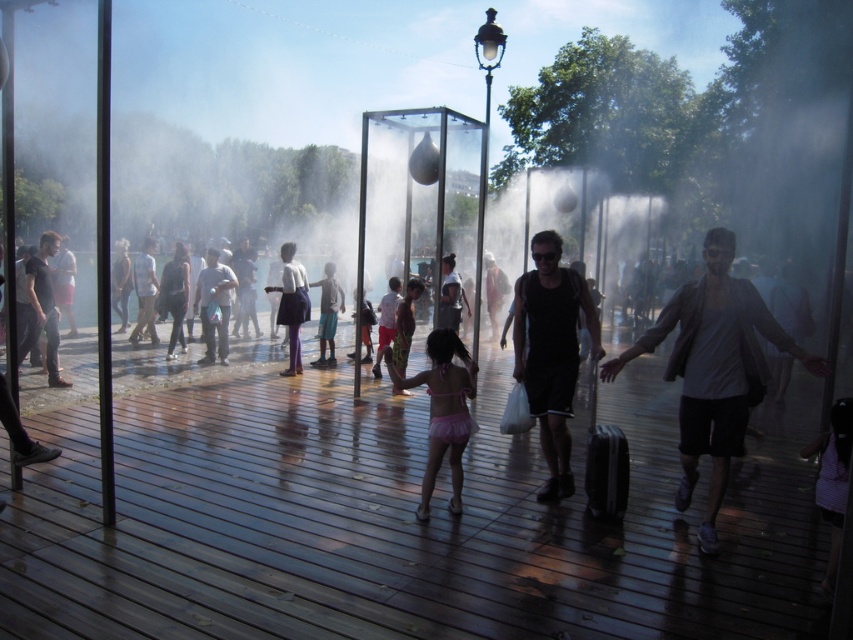
Question: Which point is farther to the camera?

Choices:
 (A) black matte tank top at center
 (B) gray cotton shirt at center

Answer: (A)

Question: Is gray cotton shirt at center wider than matte purple skirt at center?

Choices:
 (A) no
 (B) yes

Answer: (B)

Question: Which point is closer to the camera?

Choices:
 (A) matte purple skirt at center
 (B) light blue fabric pants at center
 (C) pink fabric bikini at center
 (D) gray cotton shirt at center

Answer: (D)

Question: Does gray cotton shirt at center appear under black matte tank top at center?

Choices:
 (A) yes
 (B) no

Answer: (A)

Question: Which point is closer to the camera taking this photo?

Choices:
 (A) (302, 314)
 (B) (564, 307)

Answer: (B)

Question: Where is gray cotton shirt at center located in relation to black matte tank top at center in the image?

Choices:
 (A) below
 (B) above

Answer: (A)